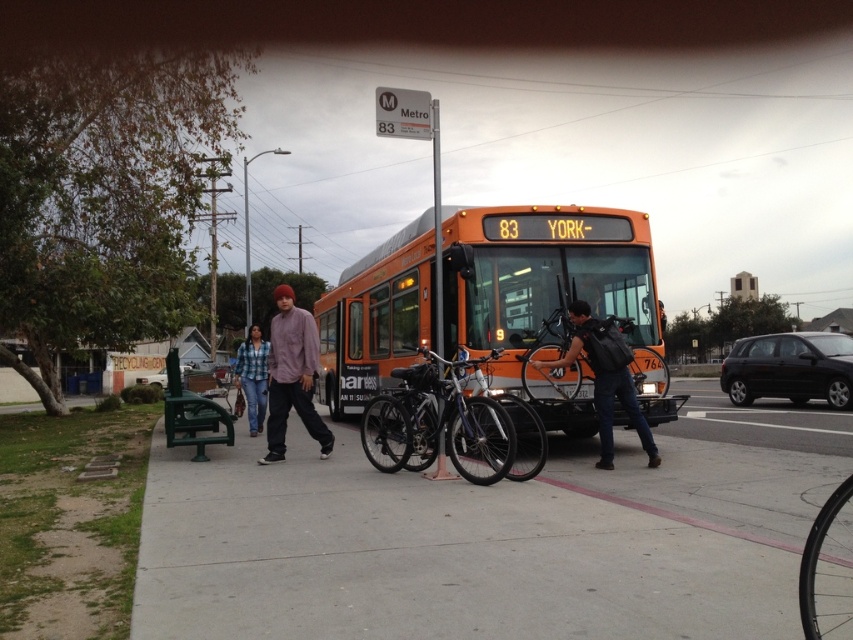
Question: Can you confirm if orange matte bus at center is positioned to the left of blue plaid shirt at center?

Choices:
 (A) yes
 (B) no

Answer: (B)

Question: Can you confirm if matte black backpack at center is positioned to the left of blue plaid shirt at center?

Choices:
 (A) no
 (B) yes

Answer: (A)

Question: Which point is closer to the camera?

Choices:
 (A) (277, 342)
 (B) (248, 406)
 (C) (445, 449)
 (D) (596, 360)

Answer: (C)

Question: Which object appears closest to the camera in this image?

Choices:
 (A) matte purple shirt at center
 (B) gray concrete pavement at lower center
 (C) green plastic bench at lower left
 (D) matte black backpack at center

Answer: (B)

Question: Estimate the real-world distances between objects in this image. Which object is closer to the orange matte bus at center?

Choices:
 (A) gray concrete pavement at lower center
 (B) matte purple shirt at center
 (C) blue plaid shirt at center

Answer: (A)

Question: Is shiny black bicycle at center to the right of blue plaid shirt at center from the viewer's perspective?

Choices:
 (A) yes
 (B) no

Answer: (A)